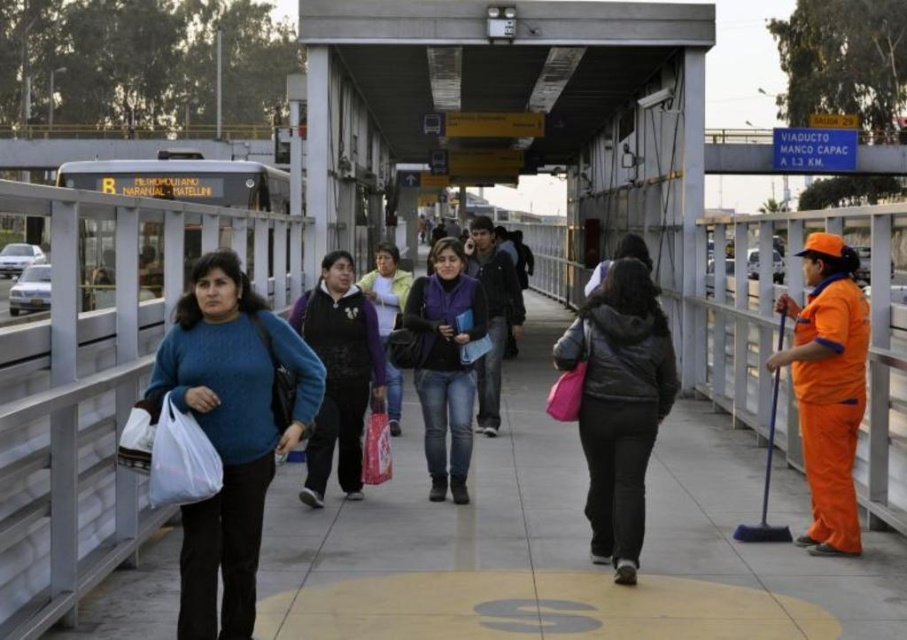
Question: Which of the following is the closest to the observer?

Choices:
 (A) (656, 592)
 (B) (830, 280)

Answer: (A)

Question: Which of the following is the closest to the observer?

Choices:
 (A) (813, 387)
 (B) (454, 396)
 (C) (357, 355)
 (D) (842, 576)

Answer: (D)

Question: Observing the image, what is the correct spatial positioning of matte concrete pavement at center in reference to denim jeans at center?

Choices:
 (A) below
 (B) above

Answer: (A)

Question: Considering the relative positions of matte concrete pavement at center and matte black jacket at center in the image provided, where is matte concrete pavement at center located with respect to matte black jacket at center?

Choices:
 (A) above
 (B) below

Answer: (B)

Question: In this image, where is orange uniform at right located relative to matte black jacket at center?

Choices:
 (A) right
 (B) left

Answer: (A)

Question: Estimate the real-world distances between objects in this image. Which object is closer to the denim jeans at center?

Choices:
 (A) matte black jacket at center
 (B) orange uniform at right
 (C) matte blue sweater at center
 (D) matte concrete pavement at center

Answer: (A)